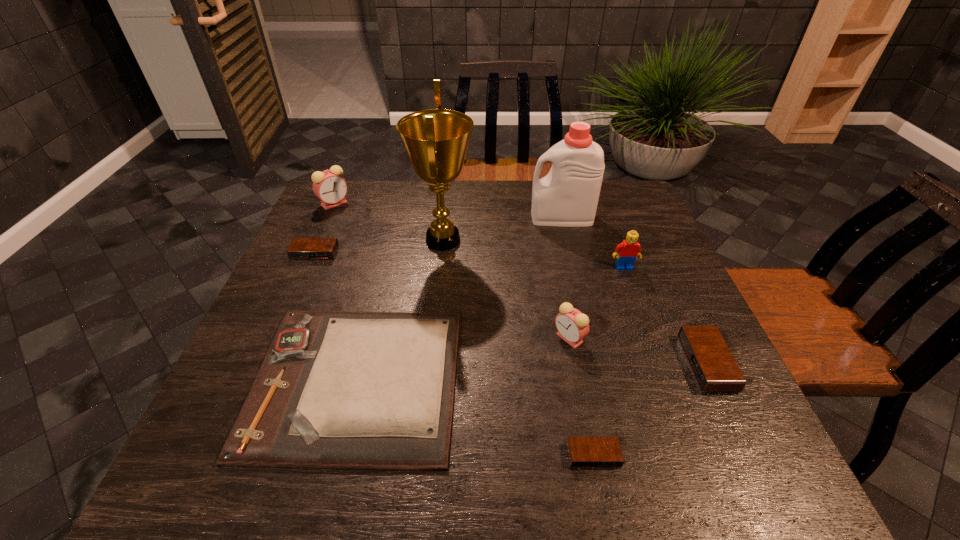
Image resolution: width=960 pixels, height=540 pixels. Identify the location of vacant region located 0.370m on the face of the farthest alarm clock. (293, 296).

The height and width of the screenshot is (540, 960). What are the coordinates of `vacant space located 0.310m on the face of the Lego` in the screenshot? It's located at (661, 369).

You are a GUI agent. You are given a task and a screenshot of the screen. Output one action in this format:
    pyautogui.click(x=<x>, y=<y>)
    Task: Click on the blank space located 0.120m on the face of the nearer pink alarm clock
    
    Given the screenshot: What is the action you would take?
    pyautogui.click(x=500, y=338)

At what (x,y) coordinates should I click in order to perform the action: click on vacant region located on the face of the nearer pink alarm clock. Please return your answer as a coordinate pair (x, y). The height and width of the screenshot is (540, 960). Looking at the image, I should click on pos(460,338).

Locate an element on the screen. The width and height of the screenshot is (960, 540). free space located 0.320m on the face of the nearer pink alarm clock is located at coordinates (410, 338).

Identify the location of free space located on the front face of the biggest black alarm clock. (537, 363).

Identify the location of vacant space located 0.340m on the front face of the biggest black alarm clock. The image size is (960, 540). [x=527, y=363].

This screenshot has width=960, height=540. I want to click on vacant space situated 0.260m on the front face of the biggest black alarm clock, so click(565, 363).

At what (x,y) coordinates should I click in order to perform the action: click on vacant space located 0.210m on the front face of the second smallest black alarm clock. Please return your answer as a coordinate pair (x, y). The height and width of the screenshot is (540, 960). Looking at the image, I should click on (286, 318).

Identify the location of vacant space located on the back of the brown clipboard. This screenshot has height=540, width=960. (387, 257).